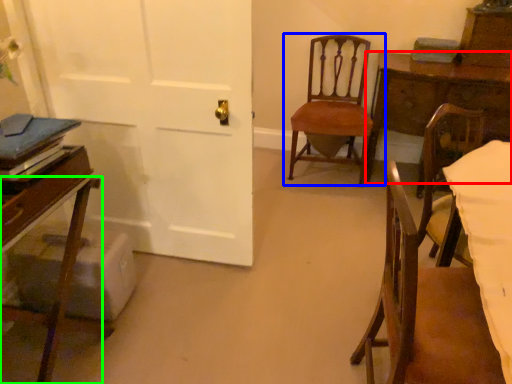
Question: Based on their relative distances, which object is nearer to table (highlighted by a red box)? Choose from chair (highlighted by a blue box) and chair (highlighted by a green box).

Choices:
 (A) chair
 (B) chair

Answer: (A)